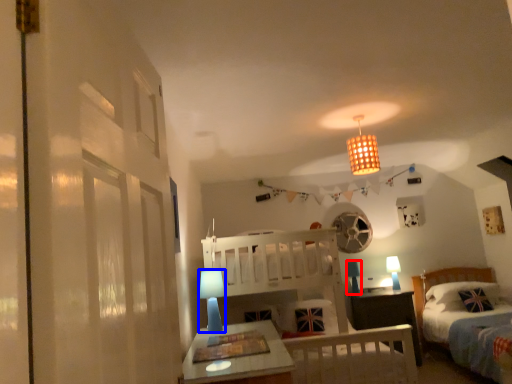
Question: Among these objects, which one is farthest to the camera, table lamp (highlighted by a red box) or table lamp (highlighted by a blue box)?

Choices:
 (A) table lamp
 (B) table lamp

Answer: (A)